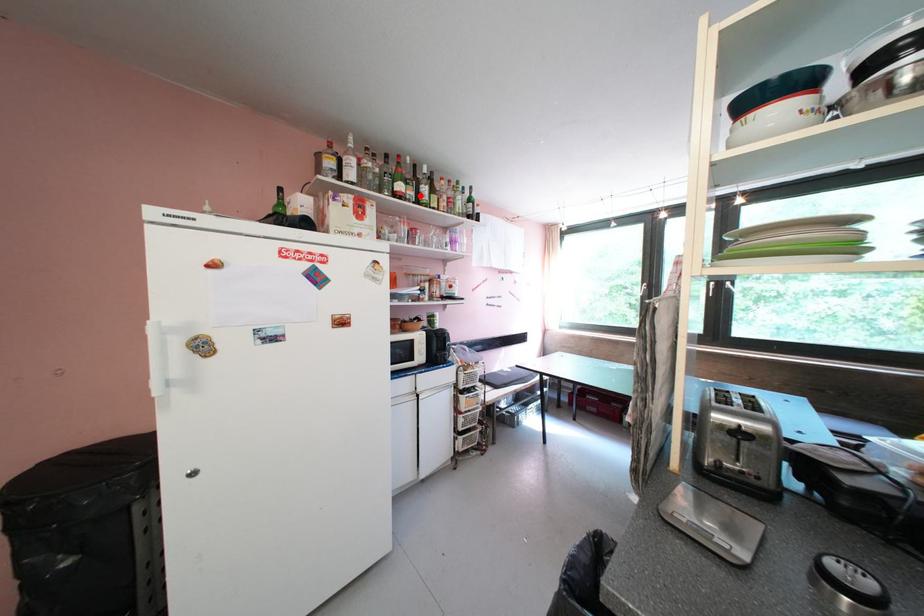
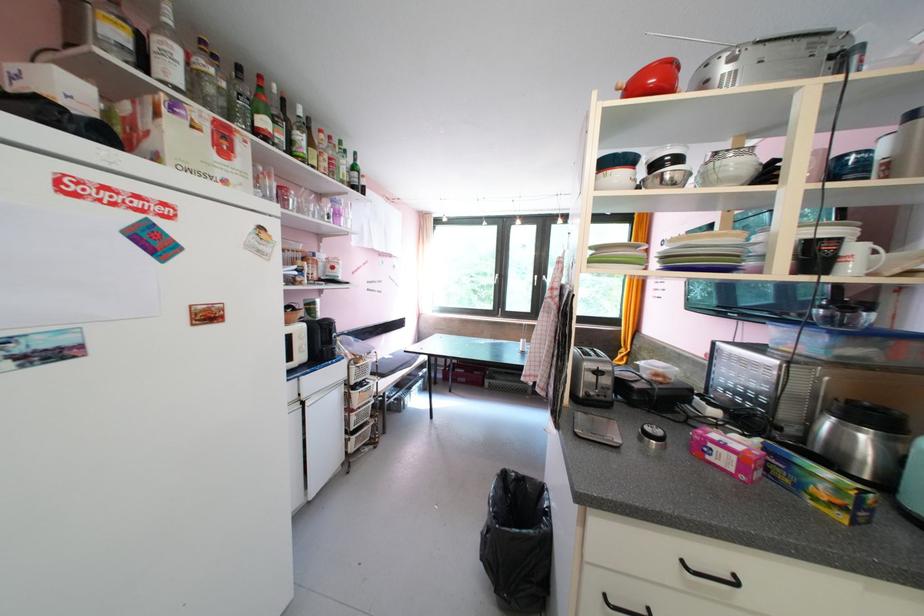
Find the pixel in the second image that matches the highlighted location in the first image.

(290, 140)